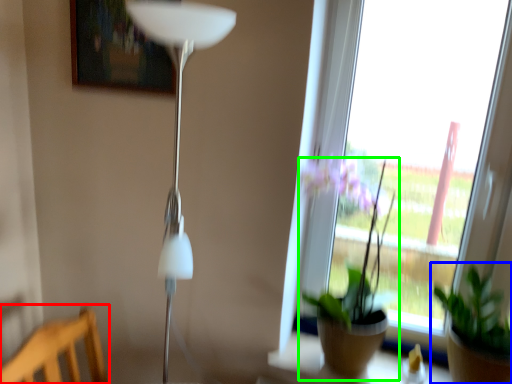
Question: Which object is the farthest from furniture (highlighted by a red box)? Choose among these: houseplant (highlighted by a blue box) or houseplant (highlighted by a green box).

Choices:
 (A) houseplant
 (B) houseplant

Answer: (A)